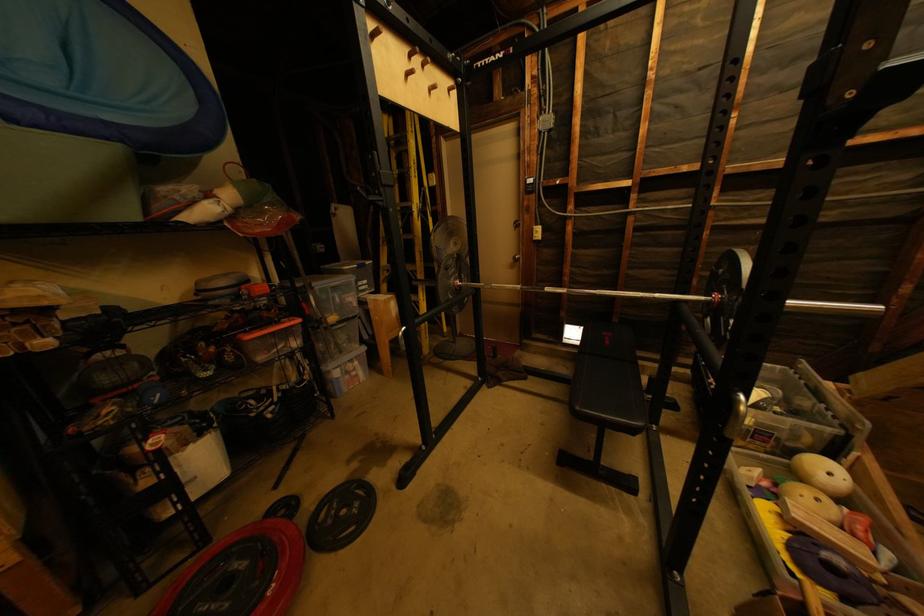
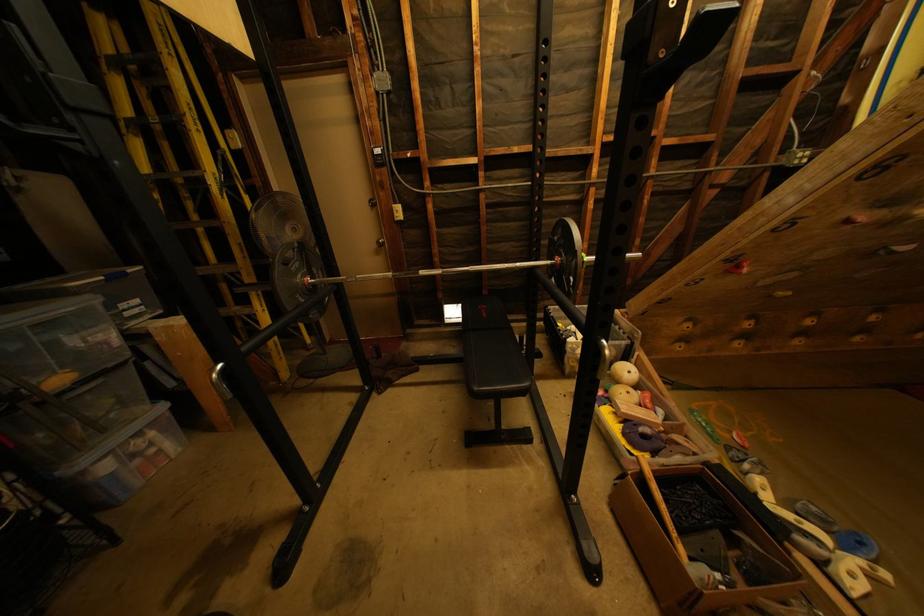
Question: How did the camera likely rotate?

Choices:
 (A) Left
 (B) Right
 (C) Up
 (D) Down

Answer: (B)